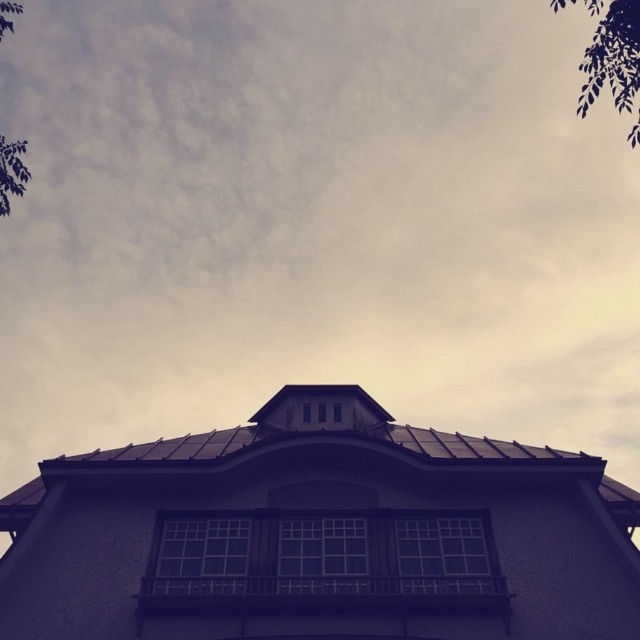
Is dark green leafy branch at upper right thinner than green leafy tree at left?

Correct, dark green leafy branch at upper right's width is less than green leafy tree at left's.

Does point (595, 13) come behind point (4, 186)?

Yes, point (595, 13) is farther from viewer.

Where is `dark green leafy branch at upper right`? dark green leafy branch at upper right is located at coordinates (611, 58).

Is metallic gray roof at center smaller than dark green leafy branch at upper right?

Yes, metallic gray roof at center is smaller than dark green leafy branch at upper right.

Between point (51, 602) and point (618, 83), which one is positioned in front?

Point (51, 602) is in front.

Is point (88, 605) more distant than point (612, 35)?

Yes, point (88, 605) is behind point (612, 35).

This screenshot has width=640, height=640. Identify the location of metallic gray roof at center. (321, 534).

Is point (180, 474) closer to camera compared to point (3, 1)?

Yes, it is.

Who is more forward, (x=390, y=524) or (x=4, y=200)?

Point (x=4, y=200) is more forward.

At what (x,y) coordinates should I click in order to perform the action: click on metallic gray roof at center. Please return your answer as a coordinate pair (x, y). The image size is (640, 640). Looking at the image, I should click on (321, 534).